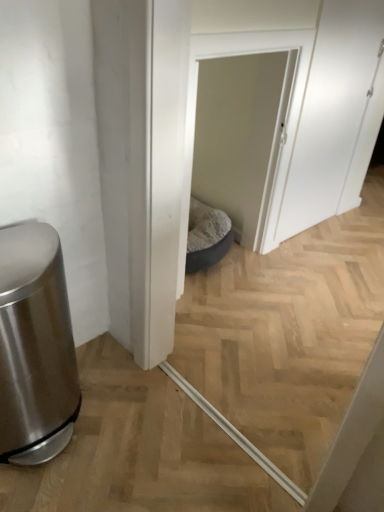
You are a GUI agent. You are given a task and a screenshot of the screen. Output one action in this format:
    pyautogui.click(x=<x>, y=<y>)
    Task: Click on the vacant point to the right of white matte screen door at upper right, which is the 1th screen door from right to left
    This screenshot has width=384, height=512.
    Given the screenshot: What is the action you would take?
    pyautogui.click(x=350, y=232)